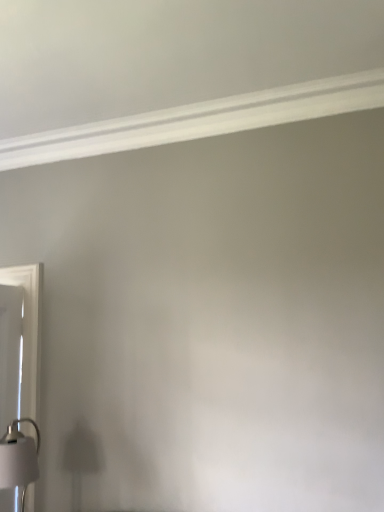
This screenshot has width=384, height=512. What do you see at coordinates (19, 458) in the screenshot?
I see `white glossy light fixture at lower left` at bounding box center [19, 458].

The image size is (384, 512). Identify the location of white glossy light fixture at lower left. (x=19, y=458).

The width and height of the screenshot is (384, 512). What are the coordinates of `white glossy light fixture at lower left` in the screenshot? It's located at (19, 458).